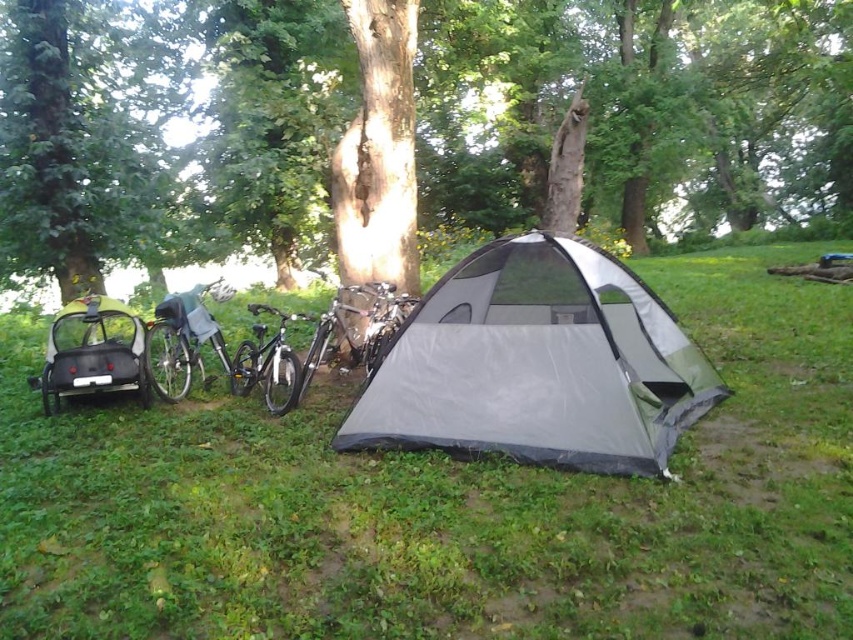
Question: Which object appears closest to the camera in this image?

Choices:
 (A) shiny black bicycle at center
 (B) gray fabric tent at center
 (C) matte black bicycle trailer at left

Answer: (B)

Question: Where is matte black bicycle trailer at left located in relation to shiny black bicycle at left in the image?

Choices:
 (A) below
 (B) above

Answer: (A)

Question: Which point is farther from the camera taking this photo?

Choices:
 (A) (486, 208)
 (B) (456, 289)
 (C) (160, 346)
 (D) (283, 349)

Answer: (A)

Question: Is green grass at center bigger than green textured tree at center?

Choices:
 (A) no
 (B) yes

Answer: (A)

Question: Which object is positioned farthest from the shiny black bicycle at center?

Choices:
 (A) gray fabric tent at center
 (B) green textured tree at center

Answer: (B)

Question: Can you confirm if green grass at center is thinner than shiny black bicycle at left?

Choices:
 (A) yes
 (B) no

Answer: (B)